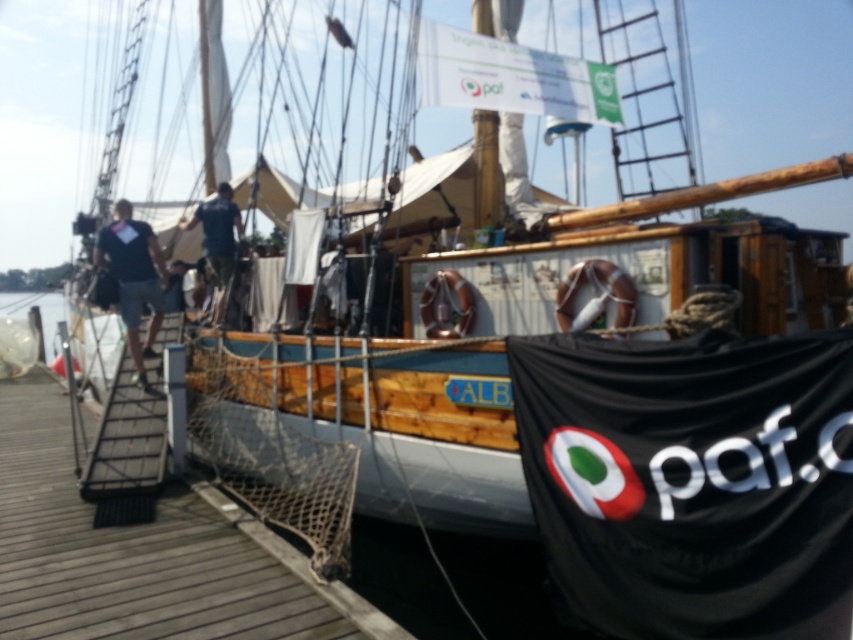
You are standing on the deck of the wooden sailing ship and see the wooden at left and the dark blue shirt at left. Which object is closer to the waterline?

The wooden at left is closer to the waterline because it is shorter than the dark blue shirt at left.

Where is the dark blue shirt at left located in the image?

The dark blue shirt at left is located at point [132,278].